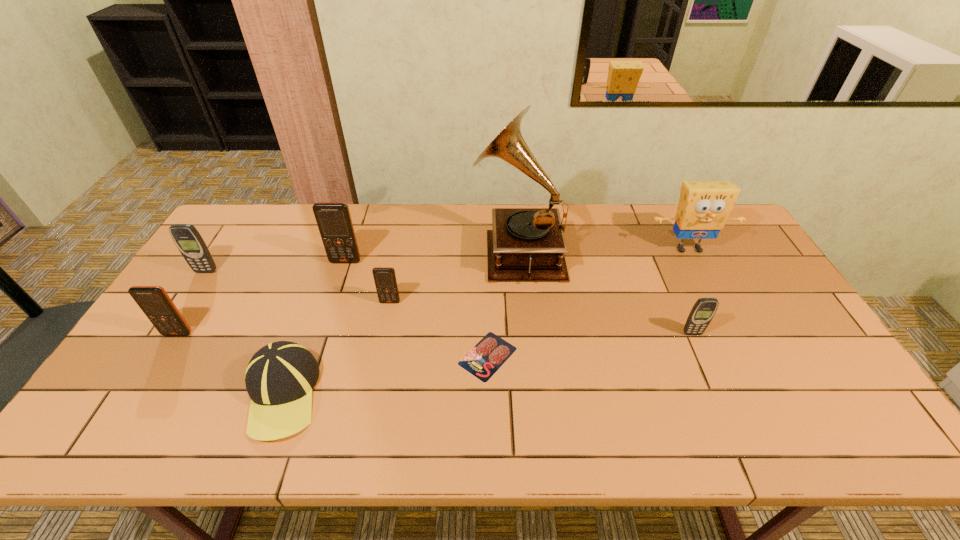
At what (x,y) coordinates should I click in order to perform the action: click on orange cellular telephone that is the nearest to the smallest orange cellular telephone. Please return your answer as a coordinate pair (x, y). Looking at the image, I should click on (334, 221).

Identify which orange cellular telephone is the nearest to the sponge. Please provide its 2D coordinates. Your answer should be formatted as a tuple, i.e. [(x, y)], where the tuple contains the x and y coordinates of a point satisfying the conditions above.

[(385, 280)]

Locate an element on the screen. The height and width of the screenshot is (540, 960). free region that satisfies the following two spatial constraints: 1. on the screen of the leftmost orange cellular telephone; 2. on the right side of the shortest object is located at coordinates (163, 356).

Image resolution: width=960 pixels, height=540 pixels. I want to click on vacant region that satisfies the following two spatial constraints: 1. on the screen of the shortest object; 2. on the left side of the second smallest orange cellular telephone, so click(163, 356).

What are the coordinates of `free space that satisfies the following two spatial constraints: 1. on the horn of the brown record player; 2. with the brim of the baseball cap facing forward` in the screenshot? It's located at (532, 394).

You are a GUI agent. You are given a task and a screenshot of the screen. Output one action in this format:
    pyautogui.click(x=<x>, y=<y>)
    Task: Click on the free spot that satisfies the following two spatial constraints: 1. on the horn of the brown record player; 2. with the brim of the baseball cap facing forward
    This screenshot has width=960, height=540.
    Given the screenshot: What is the action you would take?
    pyautogui.click(x=532, y=394)

The height and width of the screenshot is (540, 960). Find the location of `vacant point that satisfies the following two spatial constraints: 1. on the horn of the record player; 2. with the brim of the baseball cap facing forward`. vacant point that satisfies the following two spatial constraints: 1. on the horn of the record player; 2. with the brim of the baseball cap facing forward is located at coordinates (532, 394).